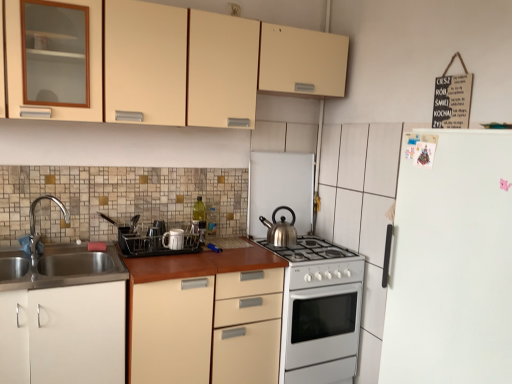
Question: Is white glossy gas stove at center located outside white matte refrigerator at right?

Choices:
 (A) yes
 (B) no

Answer: (A)

Question: Can you confirm if white glossy gas stove at center is wider than white matte refrigerator at right?

Choices:
 (A) yes
 (B) no

Answer: (B)

Question: Considering the relative sizes of white glossy gas stove at center and white matte refrigerator at right in the image provided, is white glossy gas stove at center smaller than white matte refrigerator at right?

Choices:
 (A) no
 (B) yes

Answer: (B)

Question: From the image's perspective, is white glossy gas stove at center on white matte refrigerator at right?

Choices:
 (A) yes
 (B) no

Answer: (B)

Question: Is the depth of white glossy gas stove at center greater than that of white matte refrigerator at right?

Choices:
 (A) yes
 (B) no

Answer: (A)

Question: Is white glossy gas stove at center positioned with its back to white matte refrigerator at right?

Choices:
 (A) no
 (B) yes

Answer: (A)

Question: Can you confirm if white matte cabinet at lower left, arranged as the second cabinetry when viewed from the top, is positioned to the left of glossy ceramic mug at center, marked as the second appliance in a front-to-back arrangement?

Choices:
 (A) no
 (B) yes

Answer: (B)

Question: Does white matte cabinet at lower left, the first cabinetry from the bottom, have a lesser width compared to glossy ceramic mug at center, the second appliance when ordered from left to right?

Choices:
 (A) no
 (B) yes

Answer: (A)

Question: Is white matte cabinet at lower left, arranged as the second cabinetry when viewed from the top, positioned in front of glossy ceramic mug at center, which is the 2th appliance from back to front?

Choices:
 (A) yes
 (B) no

Answer: (A)

Question: Does white matte cabinet at lower left, the first cabinetry from the bottom, have a lesser height compared to glossy ceramic mug at center, marked as the second appliance in a front-to-back arrangement?

Choices:
 (A) yes
 (B) no

Answer: (B)

Question: Is white matte cabinet at lower left, the first cabinetry from the bottom, at the right side of glossy ceramic mug at center, which is the second appliance from right to left?

Choices:
 (A) yes
 (B) no

Answer: (B)

Question: Could you tell me if white matte cabinet at lower left, arranged as the second cabinetry when viewed from the top, is turned towards glossy ceramic mug at center, which is the 2th appliance from back to front?

Choices:
 (A) no
 (B) yes

Answer: (A)

Question: Can we say matte plastic dish rack at center, which ranks as the third appliance in back-to-front order, lies outside matte beige cabinet at upper center, which appears as the 1th cabinetry when viewed from the top?

Choices:
 (A) no
 (B) yes

Answer: (B)